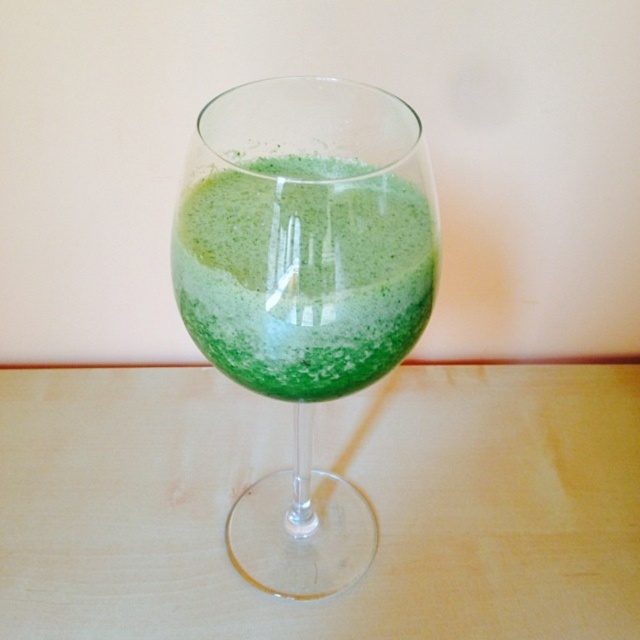
Which of these two, green glass at center or green frothy liquid at center, stands shorter?

With less height is green frothy liquid at center.

Does point (474, 561) come closer to viewer compared to point (346, 291)?

That is False.

This screenshot has height=640, width=640. Identify the location of green glass at center. (342, 476).

Is green translucent wine glass at center to the left of green frothy liquid at center from the viewer's perspective?

Indeed, green translucent wine glass at center is positioned on the left side of green frothy liquid at center.

The image size is (640, 640). What do you see at coordinates (305, 291) in the screenshot?
I see `green translucent wine glass at center` at bounding box center [305, 291].

Does point (246, 372) come closer to viewer compared to point (266, 164)?

Yes, it is.

Where is `green translucent wine glass at center`? This screenshot has width=640, height=640. green translucent wine glass at center is located at coordinates (305, 291).

What are the coordinates of `green glass at center` in the screenshot? It's located at (342, 476).

Can you confirm if green glass at center is positioned above green translucent wine glass at center?

No.

This screenshot has width=640, height=640. In order to click on green glass at center in this screenshot , I will do `click(342, 476)`.

This screenshot has width=640, height=640. In order to click on green glass at center in this screenshot , I will do (x=342, y=476).